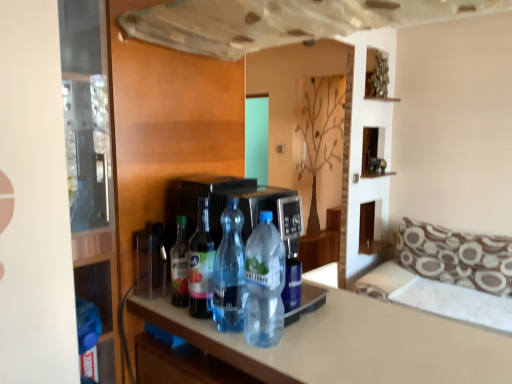
Question: Does point (173, 278) appear closer or farther from the camera than point (240, 271)?

Choices:
 (A) farther
 (B) closer

Answer: (A)

Question: Considering their positions, is translucent plastic bottle at center, the first bottle positioned from the left, located in front of or behind transparent plastic bottle at center, which appears as the 3th bottle when viewed from the left?

Choices:
 (A) behind
 (B) front

Answer: (A)

Question: Which of these objects is positioned closest to the white glossy countertop at center?

Choices:
 (A) brown patterned fabric couch at right
 (B) metallic silver sculpture at upper center
 (C) brown printed fabric pillow at right
 (D) transparent glass door at left
 (E) clear plastic bottle at center, which ranks as the 1th bottle in right-to-left order

Answer: (E)

Question: Considering the real-world distances, which object is closest to the transparent plastic bottle at center, which appears as the 3th bottle when viewed from the left?

Choices:
 (A) transparent glass door at left
 (B) clear plastic bottle at center, which ranks as the 1th bottle in right-to-left order
 (C) brown patterned fabric couch at right
 (D) metallic silver sculpture at upper center
 (E) white glossy countertop at center

Answer: (B)